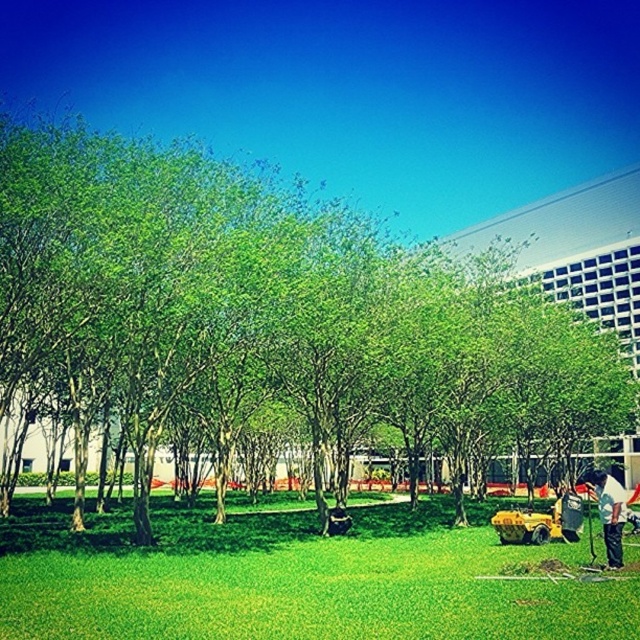
Question: Among these points, which one is nearest to the camera?

Choices:
 (A) (212, 636)
 (B) (604, 540)
 (C) (250, 184)

Answer: (A)

Question: Does green grass at lower center have a larger size compared to white fabric shirt at lower right?

Choices:
 (A) yes
 (B) no

Answer: (B)

Question: Which of the following is the closest to the observer?

Choices:
 (A) green grass at lower center
 (B) white fabric shirt at lower right

Answer: (A)

Question: Is green grass at lower center positioned before white fabric shirt at lower right?

Choices:
 (A) no
 (B) yes

Answer: (B)

Question: Estimate the real-world distances between objects in this image. Which object is farther from the white fabric shirt at lower right?

Choices:
 (A) green grass at lower center
 (B) green leafy tree at center

Answer: (B)

Question: Is green leafy tree at center wider than green grass at lower center?

Choices:
 (A) no
 (B) yes

Answer: (B)